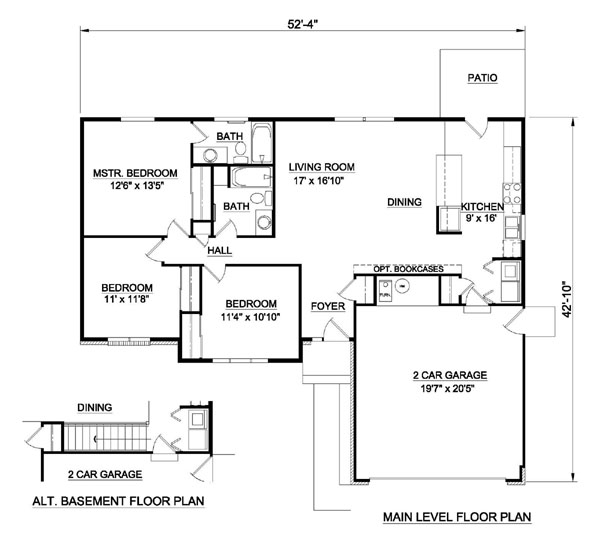
This screenshot has width=600, height=544. I want to click on hall, so [238, 253].